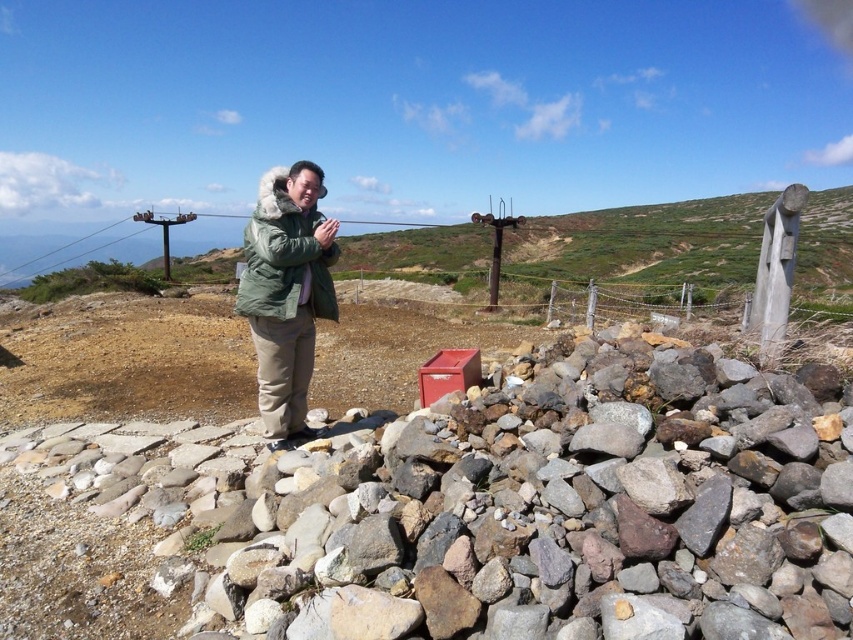
Does green grassy hillside at center appear on the left side of green fuzzy coat at center?

No, green grassy hillside at center is not to the left of green fuzzy coat at center.

Locate an element on the screen. green grassy hillside at center is located at coordinates (642, 244).

Who is more distant from viewer, (798,259) or (260,308)?

The point (798,259) is more distant.

You are a GUI agent. You are given a task and a screenshot of the screen. Output one action in this format:
    pyautogui.click(x=<x>, y=<y>)
    Task: Click on the green grassy hillside at center
    This screenshot has height=640, width=853.
    Given the screenshot: What is the action you would take?
    pyautogui.click(x=642, y=244)

Can you confirm if smooth gray rock at center is positioned to the right of green fuzzy coat at center?

Indeed, smooth gray rock at center is positioned on the right side of green fuzzy coat at center.

This screenshot has height=640, width=853. Find the location of `smooth gray rock at center`. smooth gray rock at center is located at coordinates (502, 513).

Does smooth gray rock at center have a lesser height compared to green grassy hillside at center?

Yes, smooth gray rock at center is shorter than green grassy hillside at center.

Does smooth gray rock at center appear over green grassy hillside at center?

No.

Find the location of a particular element. smooth gray rock at center is located at coordinates (502, 513).